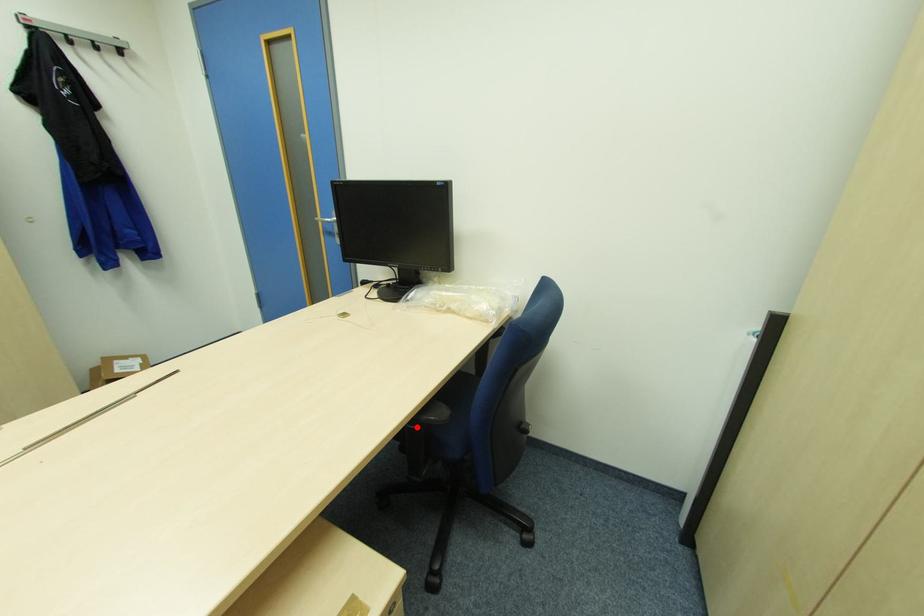
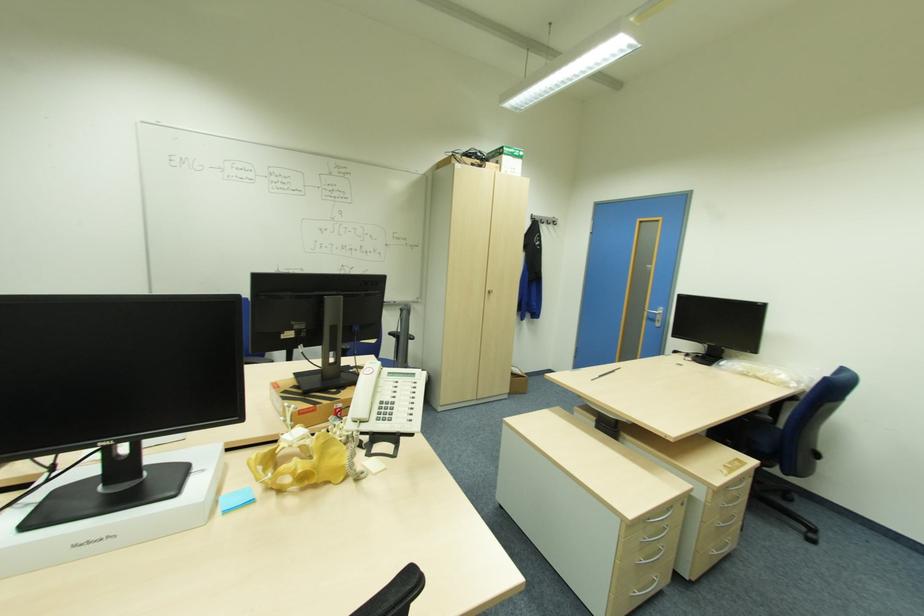
Find the pixel in the second image that matches the highlighted location in the first image.

(750, 419)